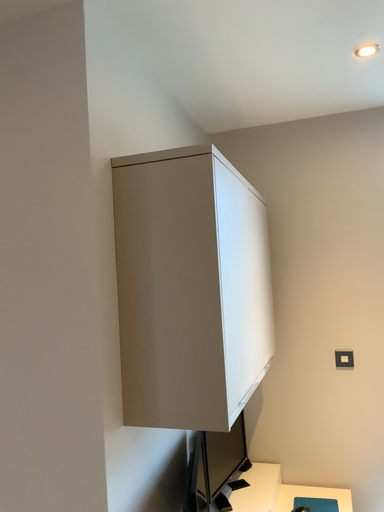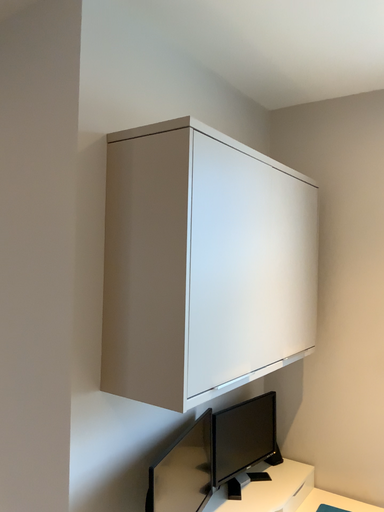
Question: How did the camera likely rotate when shooting the video?

Choices:
 (A) rotated left
 (B) rotated right

Answer: (A)